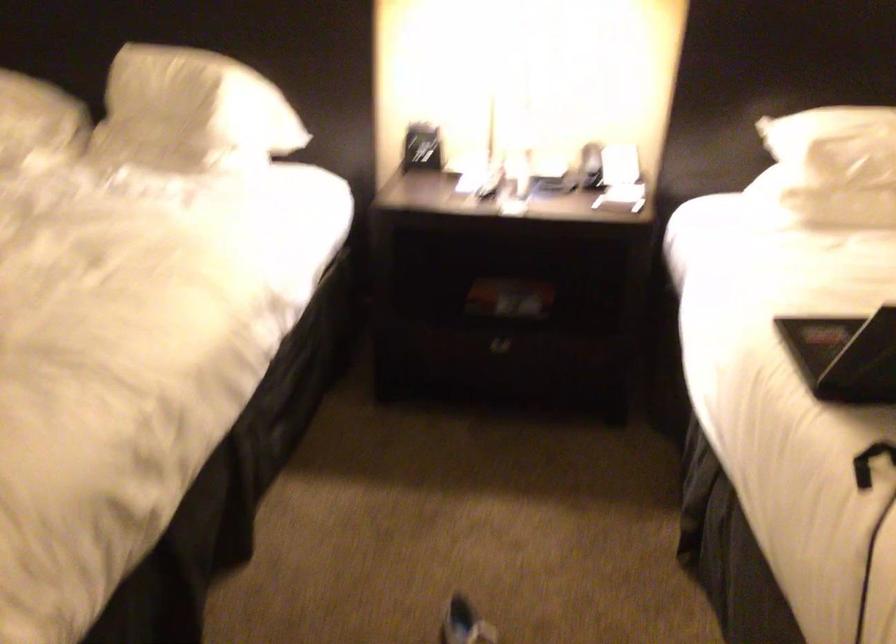
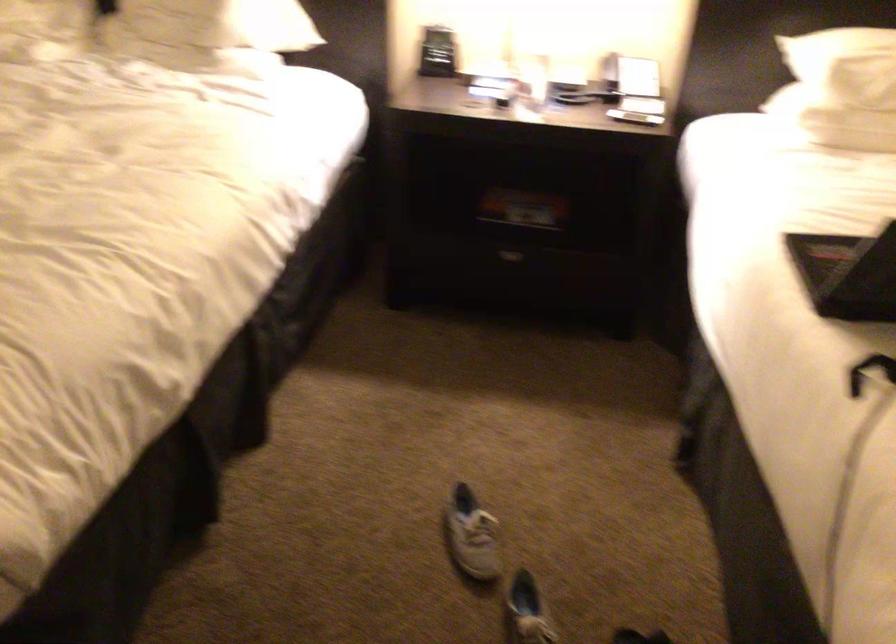
Find the pixel in the second image that matches (x=497, y=354) in the first image.

(506, 261)